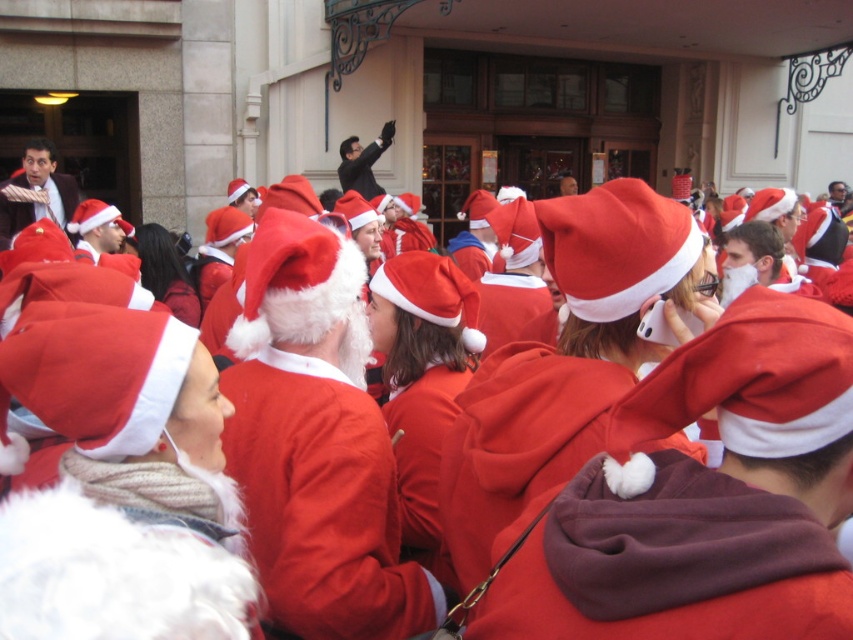
Who is lower down, matte black suit at upper left or smooth black suit at upper center?

matte black suit at upper left is below.

Who is positioned more to the left, matte black suit at upper left or smooth black suit at upper center?

matte black suit at upper left

Is point (13, 212) positioned behind point (370, 161)?

No.

Locate an element on the screen. matte black suit at upper left is located at coordinates (35, 193).